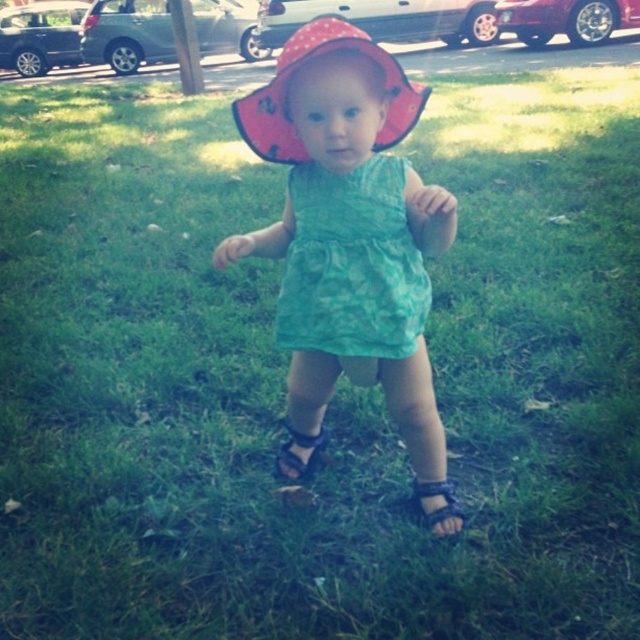
Does green tie-dye dress at center appear under black fabric sandal at lower center?

Incorrect, green tie-dye dress at center is not positioned below black fabric sandal at lower center.

Is green tie-dye dress at center thinner than black fabric sandal at lower center?

In fact, green tie-dye dress at center might be wider than black fabric sandal at lower center.

At what (x,y) coordinates should I click in order to perform the action: click on green tie-dye dress at center. Please return your answer as a coordinate pair (x, y). The image size is (640, 640). Looking at the image, I should click on (352, 264).

Does matte green dress at center appear on the right side of black fabric sandal at lower center?

In fact, matte green dress at center is to the left of black fabric sandal at lower center.

Does matte green dress at center have a greater height compared to black fabric sandal at lower center?

Yes, matte green dress at center is taller than black fabric sandal at lower center.

What do you see at coordinates (349, 228) in the screenshot? This screenshot has height=640, width=640. I see `matte green dress at center` at bounding box center [349, 228].

You are a GUI agent. You are given a task and a screenshot of the screen. Output one action in this format:
    pyautogui.click(x=<x>, y=<y>)
    Task: Click on the matte green dress at center
    
    Given the screenshot: What is the action you would take?
    pyautogui.click(x=349, y=228)

Where is `matte green dress at center`? This screenshot has height=640, width=640. matte green dress at center is located at coordinates (349, 228).

Is matte green dress at center shorter than black fabric sandal at center?

In fact, matte green dress at center may be taller than black fabric sandal at center.

Is point (416, 456) positioned after point (324, 436)?

No, it is not.

You are a GUI agent. You are given a task and a screenshot of the screen. Output one action in this format:
    pyautogui.click(x=<x>, y=<y>)
    Task: Click on the matte green dress at center
    The height and width of the screenshot is (640, 640).
    Given the screenshot: What is the action you would take?
    pyautogui.click(x=349, y=228)